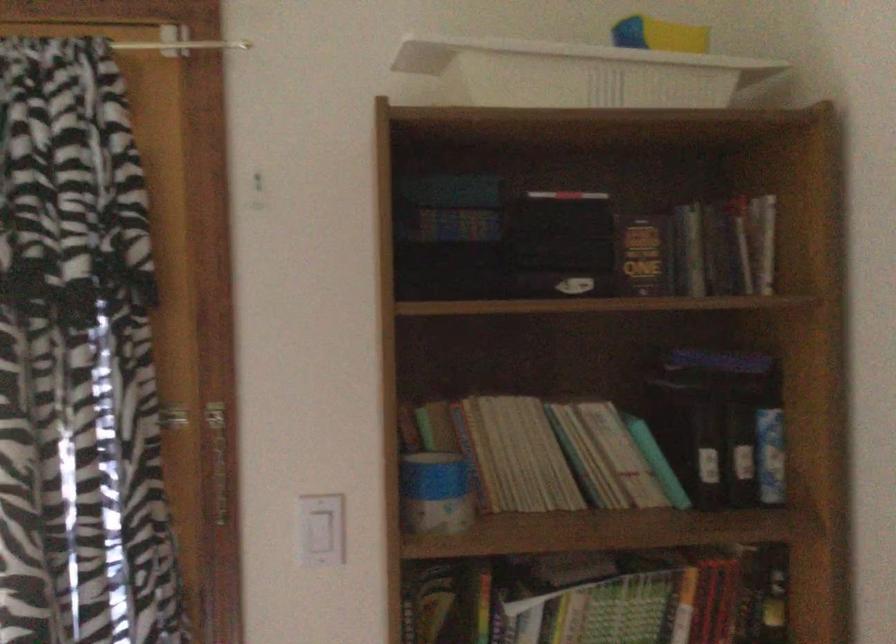
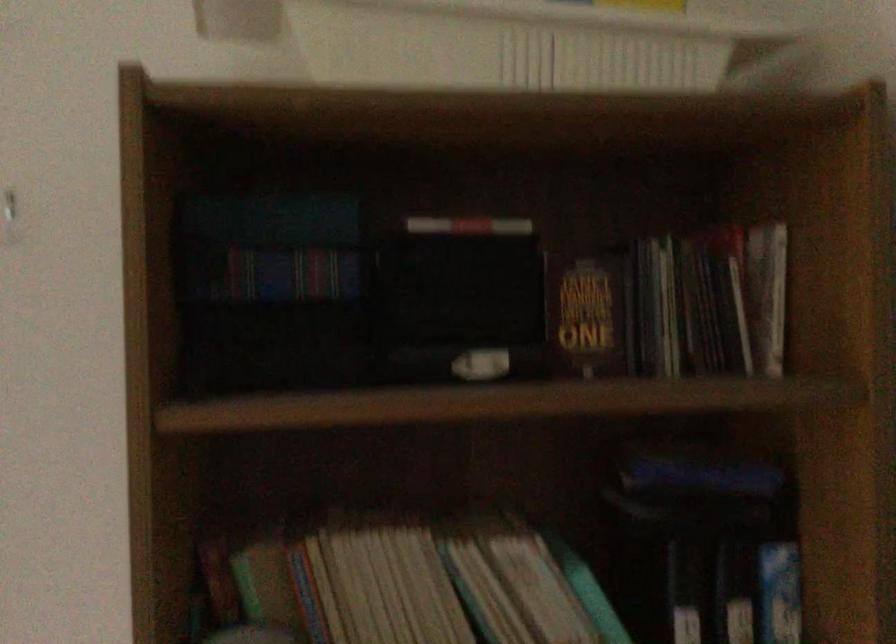
Question: Based on the continuous images, in which direction is the camera rotating? Reply with the corresponding letter.

Choices:
 (A) Left
 (B) Right
 (C) Up
 (D) Down

Answer: (B)